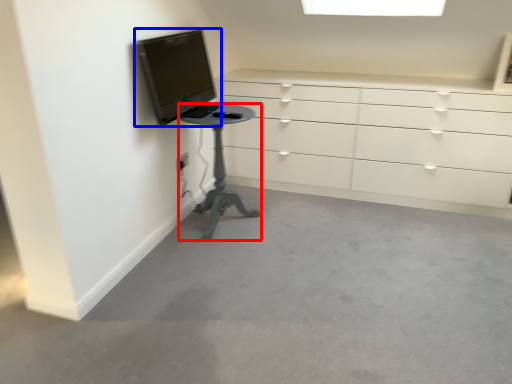
Question: Which point is closer to the camera, furniture (highlighted by a red box) or television (highlighted by a blue box)?

Choices:
 (A) furniture
 (B) television

Answer: (B)